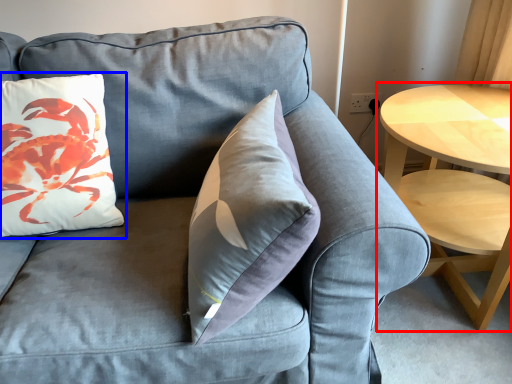
Question: Among these objects, which one is farthest to the camera, coffee table (highlighted by a red box) or pillow (highlighted by a blue box)?

Choices:
 (A) coffee table
 (B) pillow

Answer: (A)